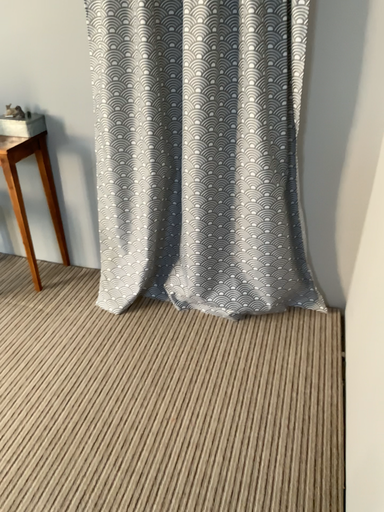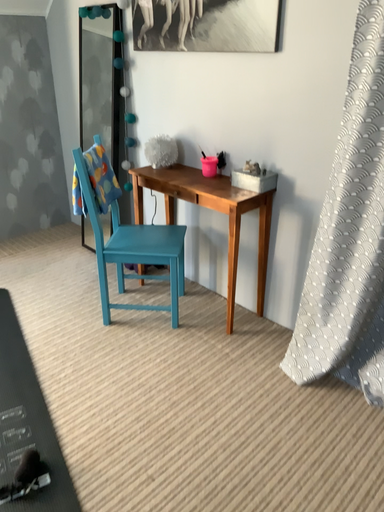
Question: How did the camera likely rotate when shooting the video?

Choices:
 (A) rotated right
 (B) rotated left

Answer: (B)